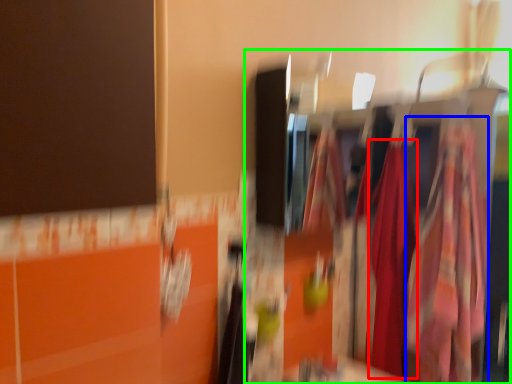
Question: Considering the real-world distances, which object is farthest from clothing (highlighted by a red box)? clothing (highlighted by a blue box) or closet (highlighted by a green box)?

Choices:
 (A) clothing
 (B) closet

Answer: (A)